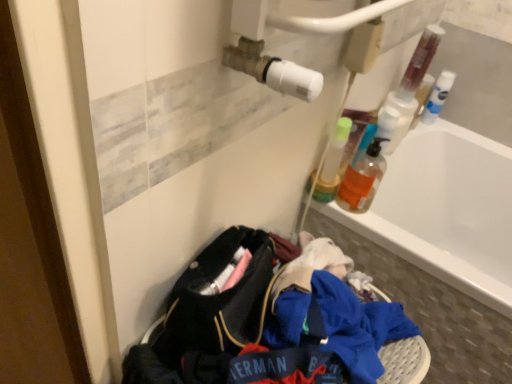
Question: Is white glossy bathtub at upper right far away from translucent plastic bottle at upper right, which is counted as the first bottle, starting from the left?

Choices:
 (A) no
 (B) yes

Answer: (A)

Question: From a real-world perspective, does white glossy bathtub at upper right stand above translucent plastic bottle at upper right, the second bottle from the back?

Choices:
 (A) yes
 (B) no

Answer: (B)

Question: Considering the relative sizes of white glossy bathtub at upper right and translucent plastic bottle at upper right, which appears as the 3th bottle when viewed from the right, in the image provided, is white glossy bathtub at upper right smaller than translucent plastic bottle at upper right, which appears as the 3th bottle when viewed from the right,?

Choices:
 (A) no
 (B) yes

Answer: (A)

Question: Is white glossy bathtub at upper right next to translucent plastic bottle at upper right, the second bottle from the back?

Choices:
 (A) yes
 (B) no

Answer: (B)

Question: From a real-world perspective, is white glossy bathtub at upper right located beneath translucent plastic bottle at upper right, which appears as the 3th bottle when viewed from the right?

Choices:
 (A) yes
 (B) no

Answer: (A)

Question: Visually, is translucent plastic bottle at upper right, the second bottle from the back, positioned to the left or to the right of translucent plastic bottle at upper right?

Choices:
 (A) left
 (B) right

Answer: (A)

Question: From a real-world perspective, is translucent plastic bottle at upper right, the second bottle from the back, above or below translucent plastic bottle at upper right?

Choices:
 (A) below
 (B) above

Answer: (B)

Question: Based on their sizes in the image, would you say translucent plastic bottle at upper right, which is counted as the 2th bottle, starting from the front, is bigger or smaller than translucent plastic bottle at upper right?

Choices:
 (A) small
 (B) big

Answer: (B)

Question: Looking at their shapes, would you say translucent plastic bottle at upper right, which appears as the 3th bottle when viewed from the right, is wider or thinner than translucent plastic bottle at upper right?

Choices:
 (A) wide
 (B) thin

Answer: (A)

Question: From the image's perspective, is translucent orange liquid at upper right, acting as the 1th bottle starting from the front, above or below white glossy bathtub at upper right?

Choices:
 (A) above
 (B) below

Answer: (A)

Question: From a real-world perspective, is translucent orange liquid at upper right, which ranks as the third bottle in back-to-front order, positioned above or below white glossy bathtub at upper right?

Choices:
 (A) above
 (B) below

Answer: (A)

Question: Would you say translucent orange liquid at upper right, the second bottle when ordered from left to right, is inside or outside white glossy bathtub at upper right?

Choices:
 (A) outside
 (B) inside

Answer: (A)

Question: Based on their positions, is translucent orange liquid at upper right, which ranks as the third bottle in back-to-front order, located to the left or right of white glossy bathtub at upper right?

Choices:
 (A) right
 (B) left

Answer: (B)

Question: From the image's perspective, is white glossy bathtub at upper right located above or below white plastic bottle at upper right, which is counted as the first bottle, starting from the back?

Choices:
 (A) below
 (B) above

Answer: (A)

Question: In terms of width, does white glossy bathtub at upper right look wider or thinner when compared to white plastic bottle at upper right, which is the first bottle in right-to-left order?

Choices:
 (A) wide
 (B) thin

Answer: (A)